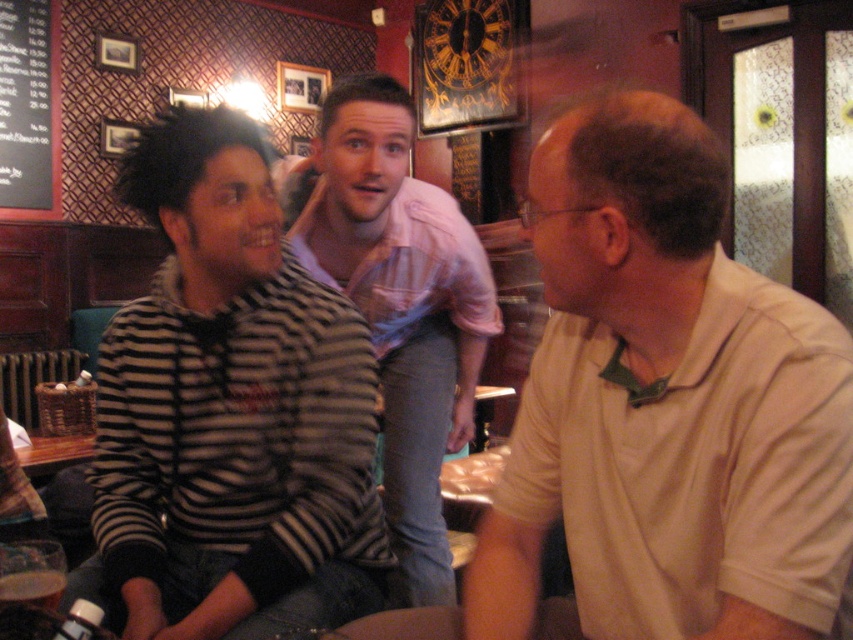
You are a new customer entering the pub and want to order a drink. The bartender is wearing the light beige shirt at center. To locate the bartender, where should you look relative to the black chalkboard at upper left?

The light beige shirt at center is to the right of the black chalkboard at upper left, so you should look to the right side of the black chalkboard at upper left to find the bartender.

You are a photographer standing in the pub and want to take a group photo of the light beige shirt at center and the black chalkboard at upper left. Which object is wider so that it can be framed better in the photo?

The light beige shirt at center is wider than the black chalkboard at upper left, so it can be framed better in the photo.

In the scene shown: You are a customer in the pub and want to order a drink. You see the black chalkboard at upper left and the brown paper cup at lower left. Which object is closer to you?

The black chalkboard at upper left is closer to you because it is further to the viewer than the brown paper cup at lower left.